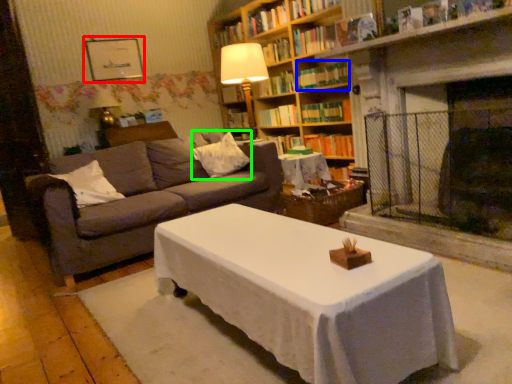
Question: Considering the real-world distances, which object is closest to picture frame (highlighted by a red box)? book (highlighted by a blue box) or pillow (highlighted by a green box).

Choices:
 (A) book
 (B) pillow

Answer: (B)